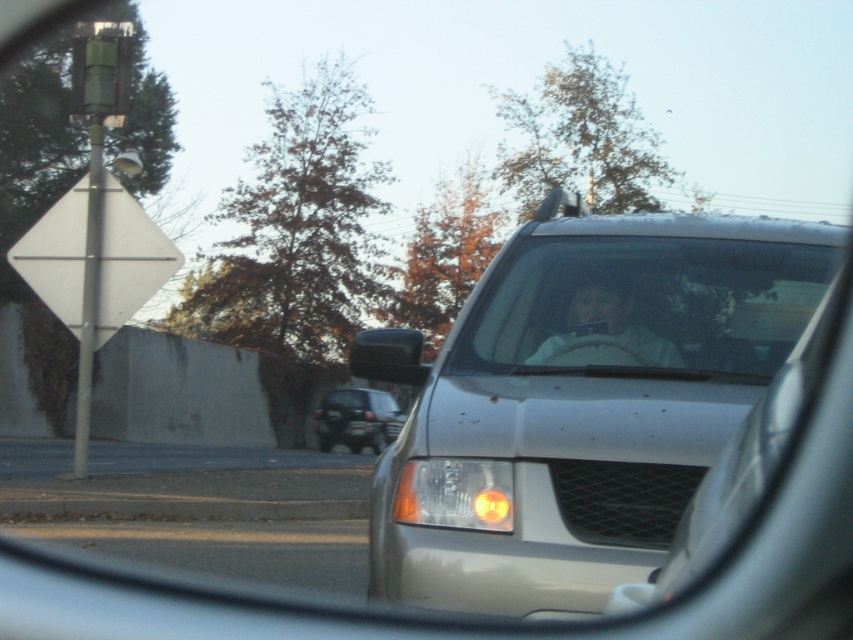
You are a delivery driver who needs to maintain a safe distance of at least 4 meters between your vehicle and the satin silver van at center. According to the image, is the current distance sufficient?

The satin silver van at center is 4.43 meters from the camera, which is more than the required 4 meters, so the current distance is sufficient.

You are a passenger in a car and looking at the side mirror. You see the satin silver van at center and the black rubber rearview mirror at center. Which object is positioned to the right side of the other?

The satin silver van at center is positioned to the right of the black rubber rearview mirror at center.

You are a driver trying to change lanes. You see the satin silver van at center in your side mirror. Based on its position, which direction is the van located relative to your vehicle?

The satin silver van at center is positioned at coordinates point (585, 403), which places it to the right side of your vehicle.